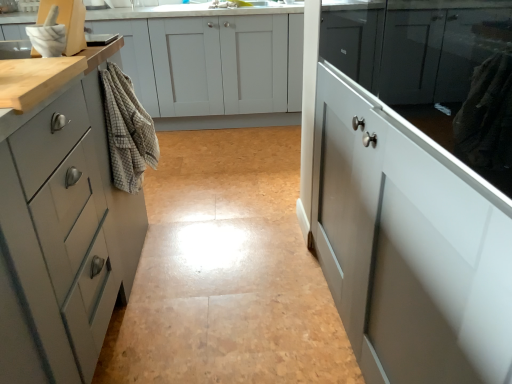
Question: Is matte white cabinets at center, which ranks as the fourth cabinetry in front-to-back order, inside the boundaries of brushed metal faucet at upper center, marked as the first faucet in a right-to-left arrangement, or outside?

Choices:
 (A) outside
 (B) inside

Answer: (A)

Question: In the image, is matte white cabinets at center, the first cabinetry from the back, on the left side or the right side of brushed metal faucet at upper center, which is the 2th faucet in back-to-front order?

Choices:
 (A) left
 (B) right

Answer: (A)

Question: Considering the real-world distances, which object is farthest from the matte white cabinet at right, marked as the 2th cabinetry in a front-to-back arrangement?

Choices:
 (A) brushed metal faucet at upper center, the second faucet positioned from the front
 (B) beige checkered towel at left
 (C) matte gray cabinet at left, acting as the second cabinetry starting from the back
 (D) matte white cabinets at center, which ranks as the fourth cabinetry in front-to-back order
 (E) white glossy cabinet at right, placed as the fourth cabinetry when sorted from back to front

Answer: (A)

Question: Estimate the real-world distances between objects in this image. Which object is farther from the brushed metal faucet at upper center, marked as the first faucet in a right-to-left arrangement?

Choices:
 (A) brushed metal faucet at upper center, which appears as the second faucet when viewed from the right
 (B) matte white cabinets at center, which ranks as the fourth cabinetry in front-to-back order
 (C) white glossy cabinet at right, placed as the fourth cabinetry when sorted from back to front
 (D) matte white cabinet at right, which is counted as the 3th cabinetry, starting from the back
 (E) beige checkered towel at left

Answer: (D)